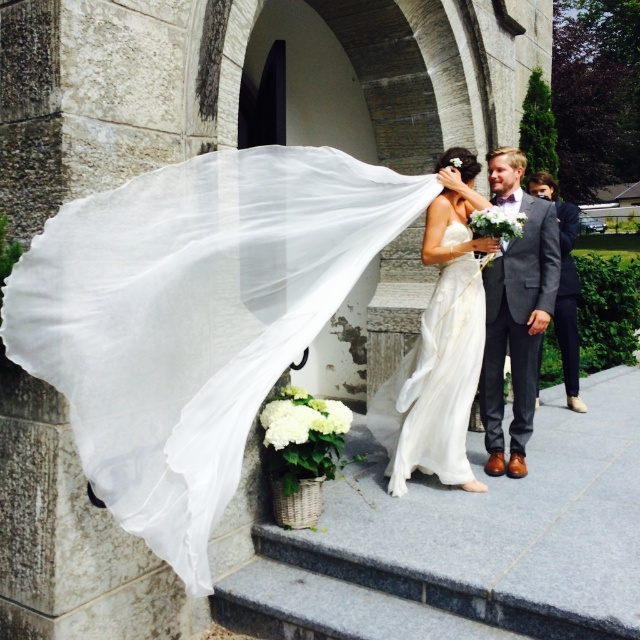
Which of these two, gray wool suit at right or matte gray suit at right, stands shorter?

With less height is gray wool suit at right.

Does gray wool suit at right appear on the right side of matte gray suit at right?

No, gray wool suit at right is not to the right of matte gray suit at right.

Image resolution: width=640 pixels, height=640 pixels. Describe the element at coordinates (515, 310) in the screenshot. I see `gray wool suit at right` at that location.

You are a GUI agent. You are given a task and a screenshot of the screen. Output one action in this format:
    pyautogui.click(x=<x>, y=<y>)
    Task: Click on the gray wool suit at right
    
    Given the screenshot: What is the action you would take?
    pyautogui.click(x=515, y=310)

Is point (424, 333) less distant than point (572, 308)?

Yes, it is in front of point (572, 308).

Does point (433, 332) come in front of point (532, 184)?

Yes, point (433, 332) is in front of point (532, 184).

What are the coordinates of `satin white dress at center` in the screenshot? It's located at (440, 344).

Consider the image. Which is above, satin white dress at center or gray wool suit at right?

Positioned higher is gray wool suit at right.

Identify the location of satin white dress at center. The width and height of the screenshot is (640, 640). (440, 344).